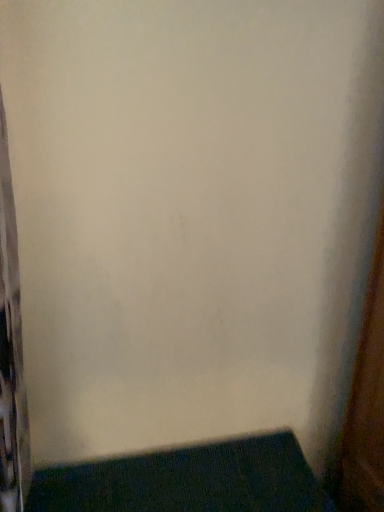
The width and height of the screenshot is (384, 512). What do you see at coordinates (188, 481) in the screenshot? I see `dark green carpet at lower left` at bounding box center [188, 481].

Image resolution: width=384 pixels, height=512 pixels. In order to click on dark green carpet at lower left in this screenshot , I will do `click(188, 481)`.

Based on the photo, measure the distance between point [245,439] and camera.

Point [245,439] and camera are 4.48 feet apart from each other.

Find the location of a particular element. Image resolution: width=384 pixels, height=512 pixels. dark green carpet at lower left is located at coordinates click(188, 481).